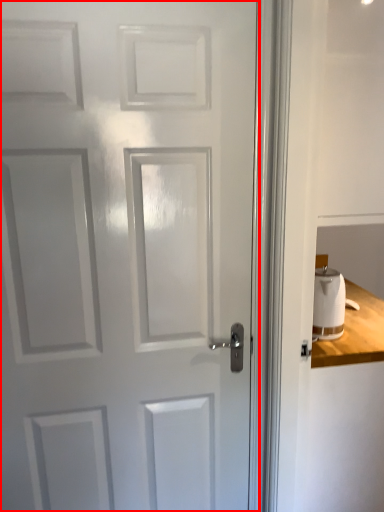
Question: From the image's perspective, where is door (annotated by the red box) located relative to toilet paper?

Choices:
 (A) above
 (B) below

Answer: (A)